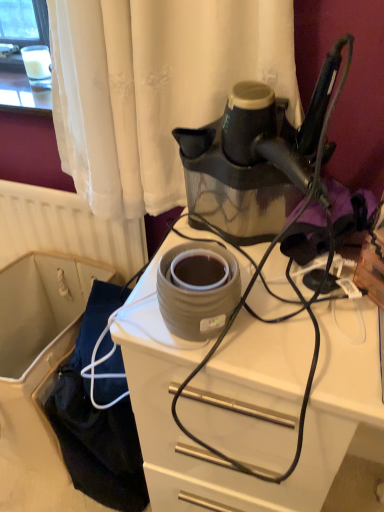
Question: Is matte gray ceramic pot at center in front of or behind matte gray ceramic at center in the image?

Choices:
 (A) behind
 (B) front

Answer: (A)

Question: Is matte gray ceramic pot at center inside the boundaries of matte gray ceramic at center, or outside?

Choices:
 (A) inside
 (B) outside

Answer: (B)

Question: Estimate the real-world distances between objects in this image. Which object is closer to the matte gray ceramic pot at center?

Choices:
 (A) matte gray ceramic at center
 (B) black rubber cord at center

Answer: (B)

Question: Based on their relative distances, which object is farther from the black rubber cord at center?

Choices:
 (A) matte gray ceramic pot at center
 (B) matte gray ceramic at center

Answer: (A)